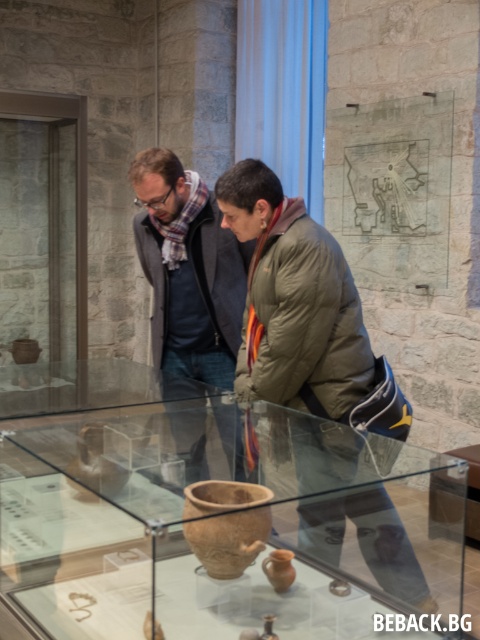
Does transparent glass box at center have a greater width compared to green matte jacket at center?

Indeed, transparent glass box at center has a greater width compared to green matte jacket at center.

Between transparent glass box at center and green matte jacket at center, which one appears on the right side from the viewer's perspective?

green matte jacket at center is more to the right.

Where is `transparent glass box at center`? transparent glass box at center is located at coordinates (215, 515).

This screenshot has height=640, width=480. Find the location of `transparent glass box at center`. transparent glass box at center is located at coordinates pyautogui.click(x=215, y=515).

Who is shorter, green matte jacket at center or matte gray jacket at center?

Standing shorter between the two is matte gray jacket at center.

Between point (139, 172) and point (190, 449), which one is positioned behind?

Point (139, 172)

I want to click on green matte jacket at center, so click(x=304, y=328).

The height and width of the screenshot is (640, 480). Identify the location of green matte jacket at center. (304, 328).

The width and height of the screenshot is (480, 640). Describe the element at coordinates (215, 515) in the screenshot. I see `transparent glass box at center` at that location.

Which of these two, transparent glass box at center or matte gray jacket at center, stands shorter?

transparent glass box at center is shorter.

Is point (323, 465) positioned in front of point (168, 209)?

Yes, point (323, 465) is closer to viewer.

This screenshot has width=480, height=640. I want to click on transparent glass box at center, so click(x=215, y=515).